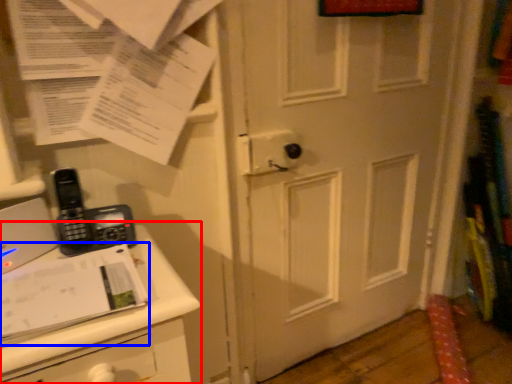
Question: Which object appears closest to the camera in this image, changing table (highlighted by a red box) or journal (highlighted by a blue box)?

Choices:
 (A) changing table
 (B) journal

Answer: (A)